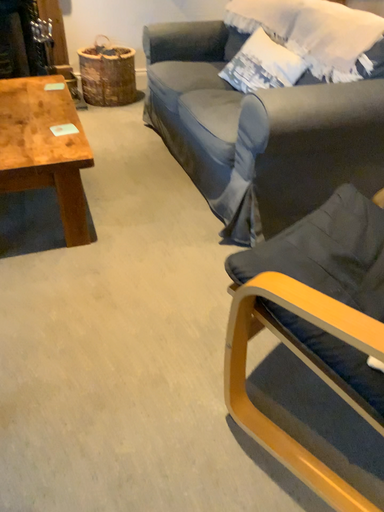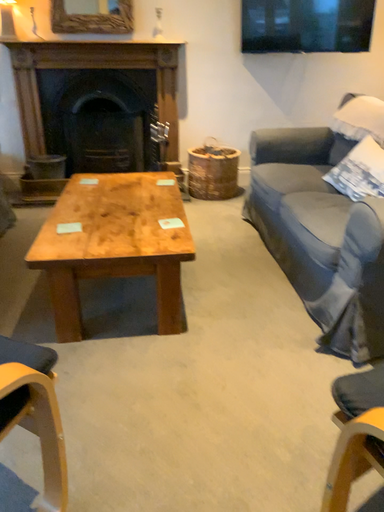
Question: Which way did the camera rotate in the video?

Choices:
 (A) rotated left
 (B) rotated right

Answer: (A)